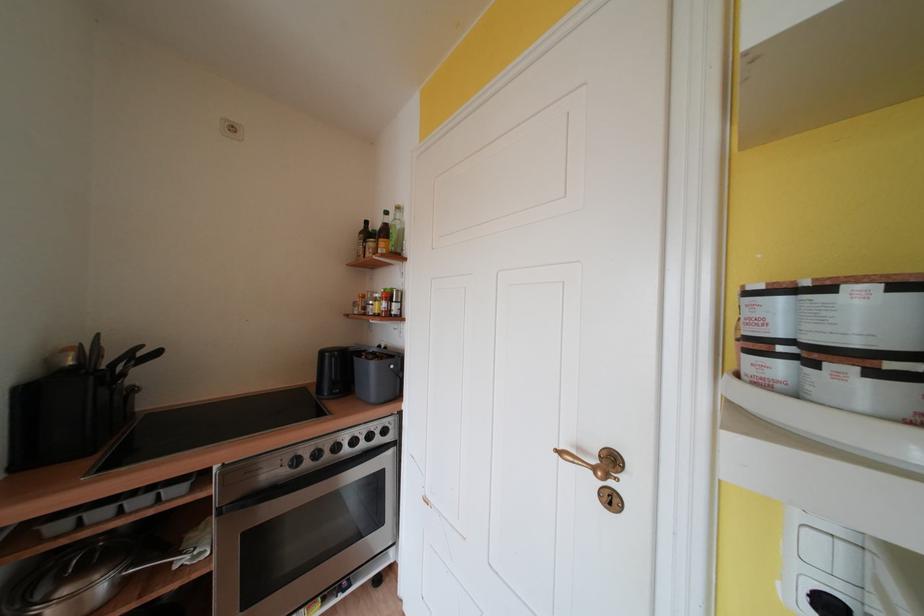
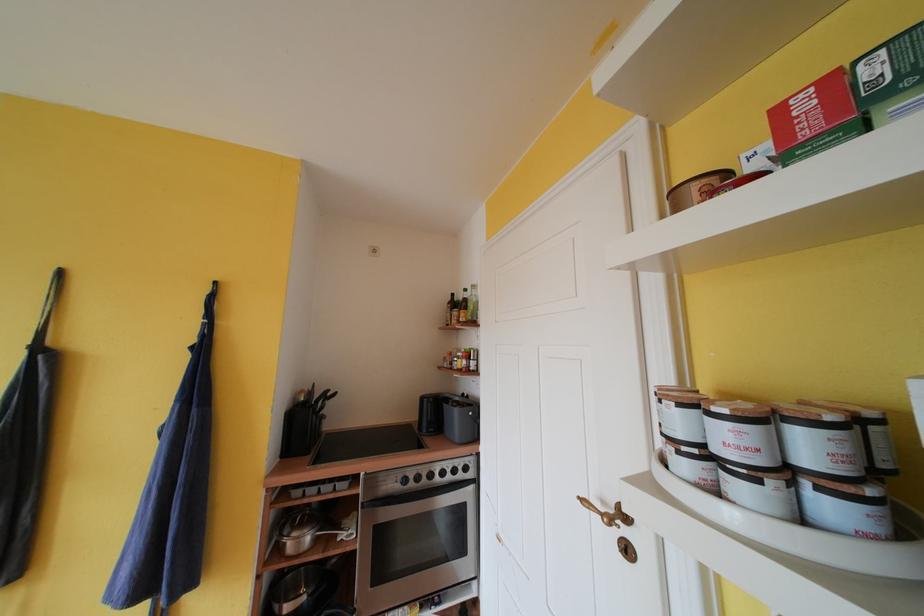
Find the pixel in the second image that matches point 369,440 in the first image.

(455, 474)